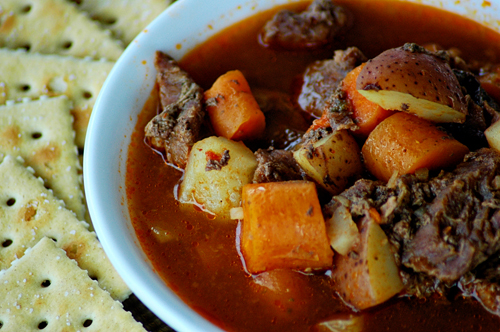
Find the location of a particular element. The image size is (500, 332). corner is located at coordinates (44, 238), (5, 158), (64, 96).